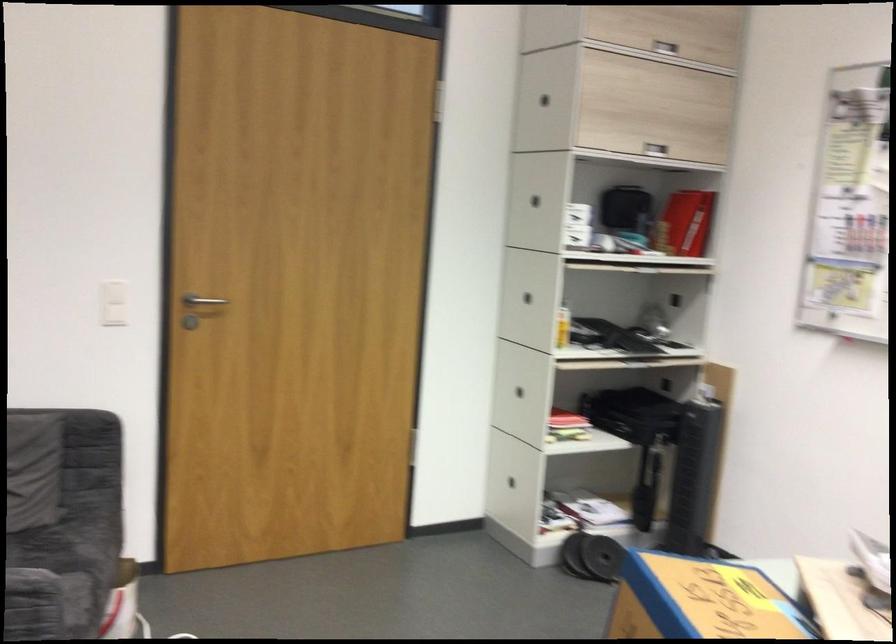
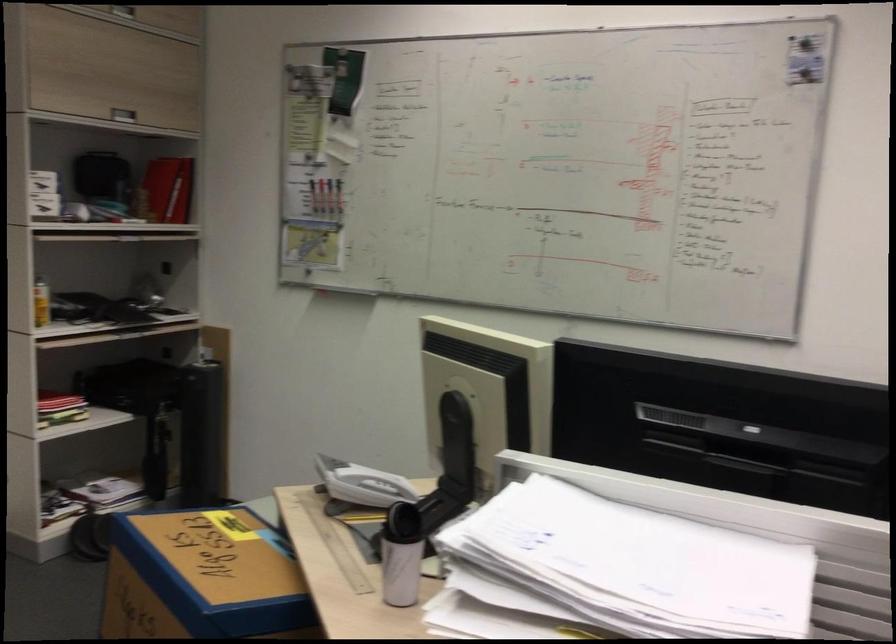
Find the pixel in the second image that matches point (653, 482) in the first image.

(169, 451)